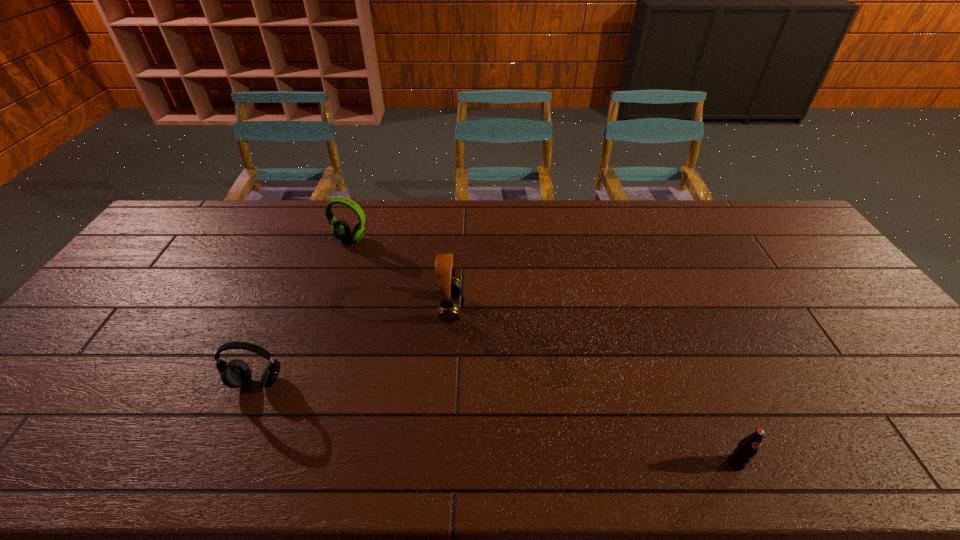
Find the location of a particular element. Image resolution: width=960 pixels, height=540 pixels. free space between the nearest object and the second farthest object is located at coordinates (593, 386).

The width and height of the screenshot is (960, 540). Find the location of `vacant space that is in between the farthest object and the nearest headset`. vacant space that is in between the farthest object and the nearest headset is located at coordinates (304, 311).

Where is `vacant point located between the third object from left to right and the nearest headset`? vacant point located between the third object from left to right and the nearest headset is located at coordinates (x=354, y=345).

At what (x,y) coordinates should I click in order to perform the action: click on free point between the pop and the third object from left to right. Please return your answer as a coordinate pair (x, y). The width and height of the screenshot is (960, 540). Looking at the image, I should click on (593, 386).

Locate an element on the screen. free space that is in between the nearest headset and the farthest object is located at coordinates (304, 311).

Locate an element on the screen. This screenshot has height=540, width=960. free space between the pop and the second nearest headset is located at coordinates (593, 386).

This screenshot has height=540, width=960. What are the coordinates of `free space between the rightmost object and the farthest headset` in the screenshot? It's located at (543, 351).

The image size is (960, 540). What are the coordinates of `object identified as the closest to the pop` in the screenshot? It's located at (449, 288).

Locate which object is the second closest to the farthest object. Please provide its 2D coordinates. Your answer should be formatted as a tuple, i.e. [(x, y)], where the tuple contains the x and y coordinates of a point satisfying the conditions above.

[(236, 373)]

Identify which headset is the closest to the farthest object. Please provide its 2D coordinates. Your answer should be formatted as a tuple, i.e. [(x, y)], where the tuple contains the x and y coordinates of a point satisfying the conditions above.

[(449, 288)]